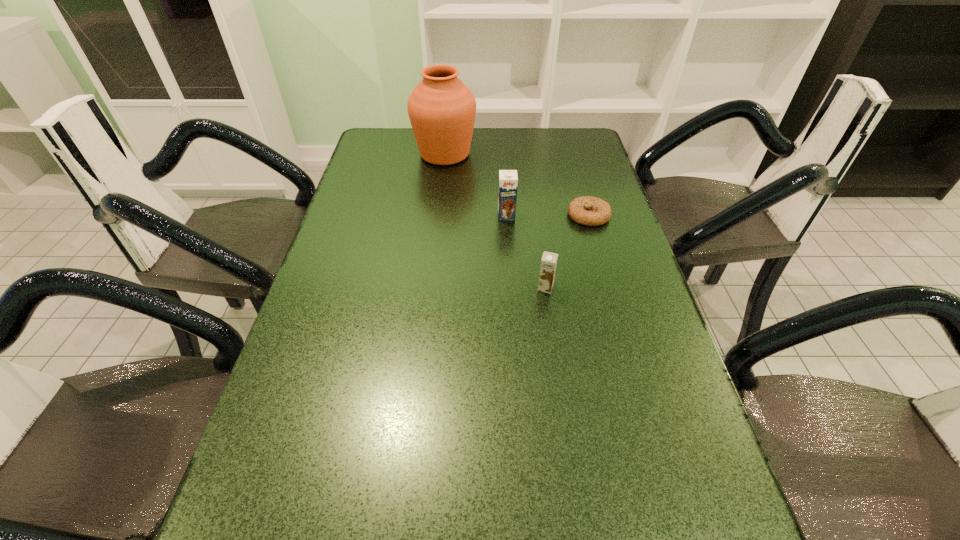
I want to click on vacant space that is in between the second object from right to left and the left chocolate milk, so click(x=526, y=252).

The height and width of the screenshot is (540, 960). Identify the location of vacant region between the taller chocolate milk and the nearer chocolate milk. (526, 252).

The image size is (960, 540). I want to click on free area in between the farthest object and the second shortest object, so click(495, 221).

I want to click on free spot between the rightmost object and the nearest object, so click(567, 251).

Where is `free space between the leftmost object and the second shortest object`? This screenshot has width=960, height=540. free space between the leftmost object and the second shortest object is located at coordinates (495, 221).

At what (x,y) coordinates should I click in order to perform the action: click on free space between the rightmost object and the nearer chocolate milk. Please return your answer as a coordinate pair (x, y). The width and height of the screenshot is (960, 540). Looking at the image, I should click on [x=567, y=251].

The width and height of the screenshot is (960, 540). Find the location of `vacant area that lies between the urn and the taller chocolate milk`. vacant area that lies between the urn and the taller chocolate milk is located at coordinates (475, 185).

Select which object is the second closest to the farther chocolate milk. Please provide its 2D coordinates. Your answer should be formatted as a tuple, i.e. [(x, y)], where the tuple contains the x and y coordinates of a point satisfying the conditions above.

[(442, 110)]

Select which object appears as the third closest to the nearer chocolate milk. Please provide its 2D coordinates. Your answer should be formatted as a tuple, i.e. [(x, y)], where the tuple contains the x and y coordinates of a point satisfying the conditions above.

[(442, 110)]

You are a GUI agent. You are given a task and a screenshot of the screen. Output one action in this format:
    pyautogui.click(x=<x>, y=<y>)
    Task: Click on the vacant space that satisfies the following two spatial constraints: 1. on the front label of the third shortest object; 2. on the right side of the nearest object
    The image size is (960, 540).
    Given the screenshot: What is the action you would take?
    pyautogui.click(x=512, y=287)